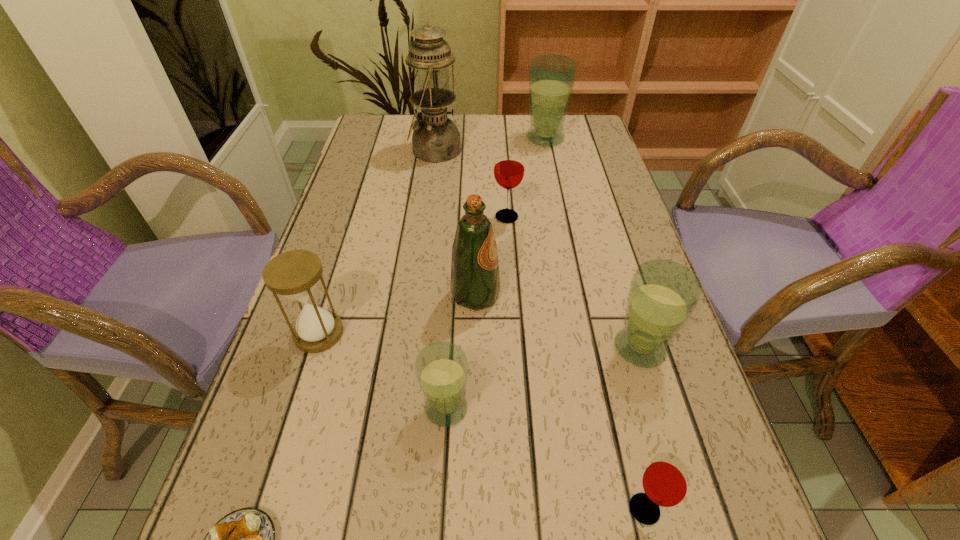
Identify which object is the closest to the second smallest blue glass. Please provide its 2D coordinates. Your answer should be formatted as a tuple, i.e. [(x, y)], where the tuple contains the x and y coordinates of a point satisfying the conditions above.

[(666, 481)]

Identify the location of glass that is the fourth closest one to the nearer red glass. (551, 77).

Identify the location of the closest glass to the tallest object. (551, 77).

Identify which blue glass is the nearest to the hourglass. Please provide its 2D coordinates. Your answer should be formatted as a tuple, i.e. [(x, y)], where the tuple contains the x and y coordinates of a point satisfying the conditions above.

[(441, 368)]

The width and height of the screenshot is (960, 540). I want to click on blue glass that is the second closest to the bigger red glass, so click(663, 294).

At what (x,y) coordinates should I click in order to perform the action: click on vacant region that satisfies the following two spatial constraints: 1. on the front side of the oil lamp; 2. on the right side of the bigger red glass. Please return your answer as a coordinate pair (x, y). Looking at the image, I should click on (426, 217).

Where is `vacant space that satisfies the following two spatial constraints: 1. on the back side of the fourth glass from right to left; 2. on the left side of the leftmost glass`? The image size is (960, 540). vacant space that satisfies the following two spatial constraints: 1. on the back side of the fourth glass from right to left; 2. on the left side of the leftmost glass is located at coordinates (457, 217).

Find the location of a particular element. The image size is (960, 540). free location that satisfies the following two spatial constraints: 1. on the front-facing side of the right red glass; 2. on the right side of the green olive oil is located at coordinates (473, 509).

Find the location of a particular element. free space that satisfies the following two spatial constraints: 1. on the front-facing side of the green olive oil; 2. on the back side of the right red glass is located at coordinates (473, 509).

Locate an element on the screen. vacant space that satisfies the following two spatial constraints: 1. on the back side of the second farthest blue glass; 2. on the front-facing side of the olive oil is located at coordinates (623, 295).